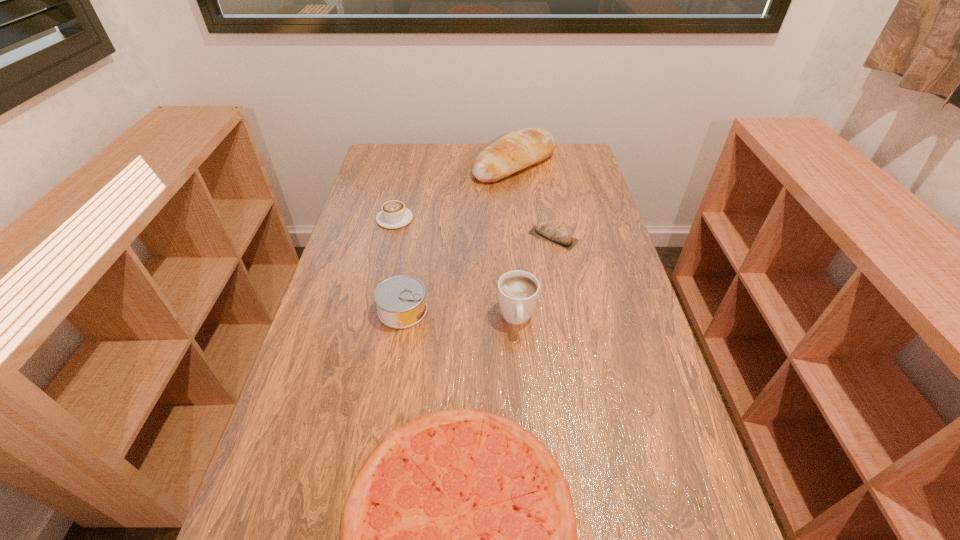
Identify the location of vacant position located with the handle on the right side of the shorter cappuccino. This screenshot has height=540, width=960. (401, 192).

Where is `free point located with the handle on the right side of the shorter cappuccino`? The width and height of the screenshot is (960, 540). free point located with the handle on the right side of the shorter cappuccino is located at coordinates (403, 184).

Find the location of a particular element. This screenshot has height=540, width=960. free region located with the handle on the right side of the shorter cappuccino is located at coordinates (410, 154).

Identify the location of vacant space located on the left of the second shortest object. (425, 237).

Locate an element on the screen. This screenshot has width=960, height=540. object that is positioned at the far edge is located at coordinates (517, 150).

I want to click on can positioned at the left edge, so click(400, 300).

At what (x,y) coordinates should I click in order to perform the action: click on cappuccino located in the left edge section of the desktop. Please return your answer as a coordinate pair (x, y). Looking at the image, I should click on (393, 214).

Where is `bread located at the right edge`? bread located at the right edge is located at coordinates (517, 150).

Find the location of `pita bread located in the right edge section of the desktop`. pita bread located in the right edge section of the desktop is located at coordinates (544, 230).

Identify the location of object at the far right corner. (517, 150).